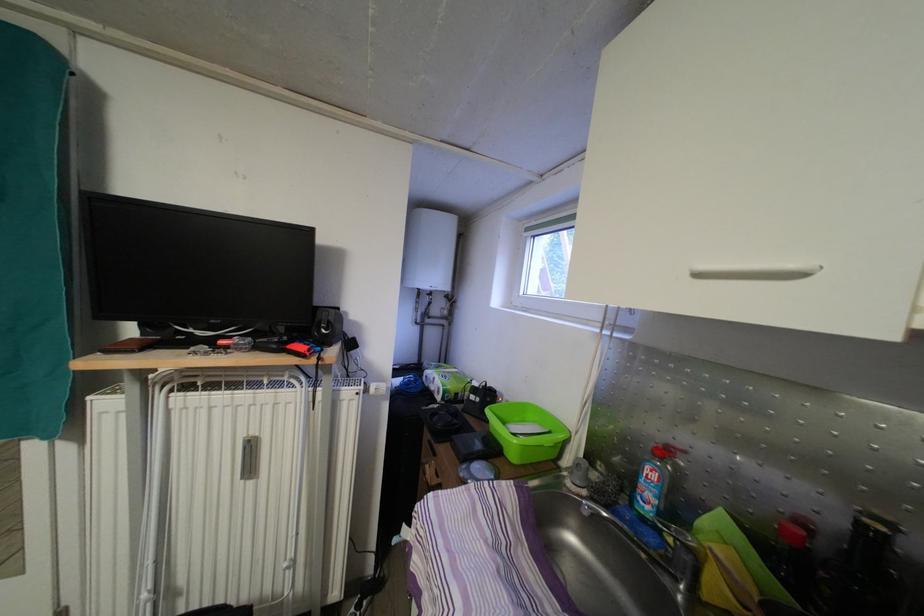
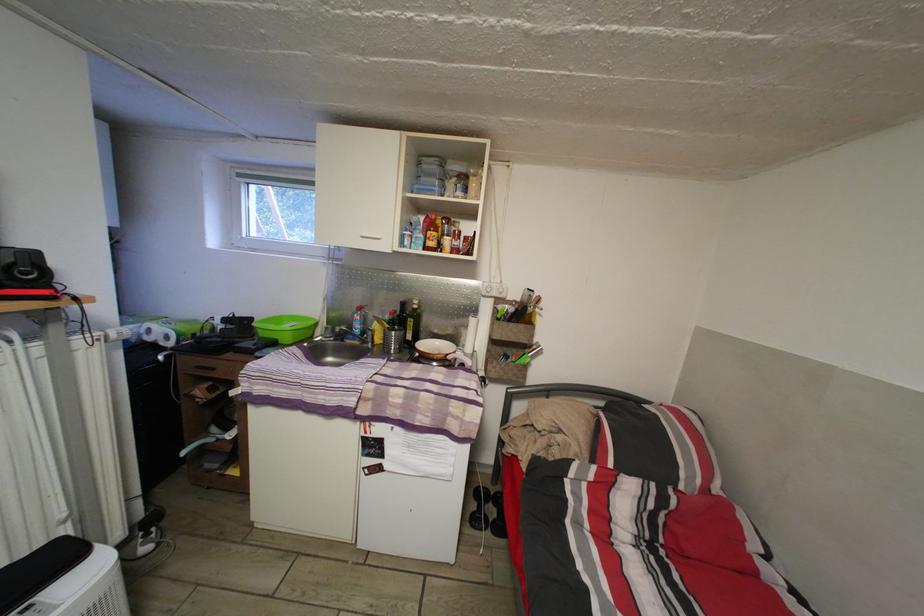
Find the pixel in the second image that matches (444,374) in the first image.

(144, 328)